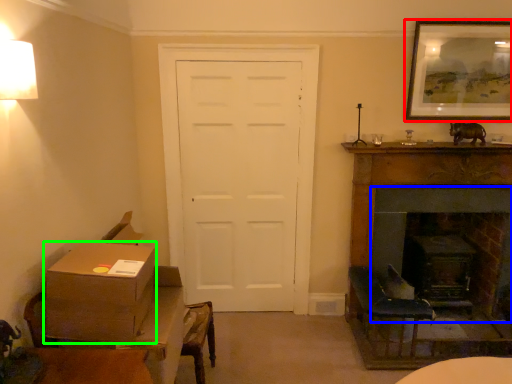
Question: Which object is positioned closest to picture frame (highlighted by a red box)? Select from fireplace (highlighted by a blue box) and box (highlighted by a green box).

Choices:
 (A) fireplace
 (B) box

Answer: (A)